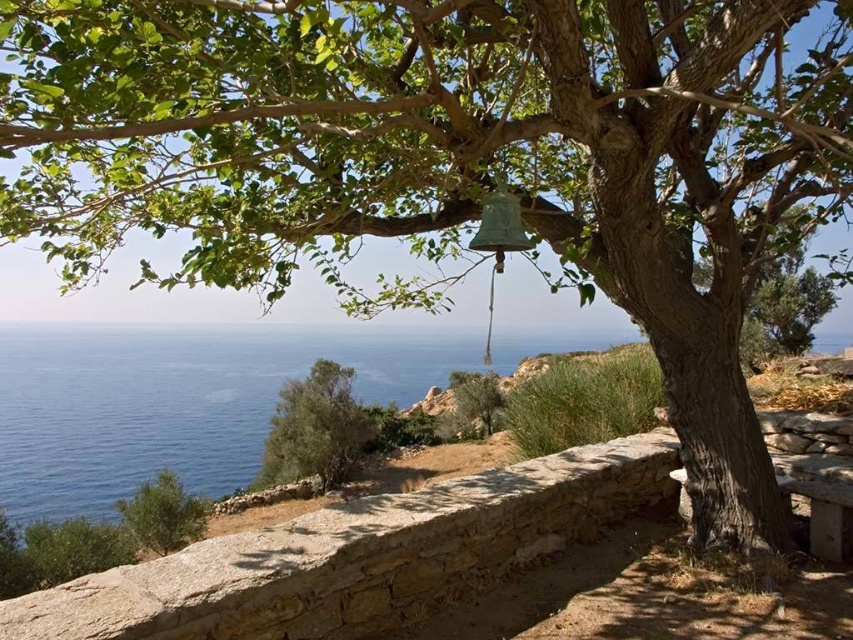
You are standing at the stone wall and want to place a small potted plant between the blue water at lower left and the green leafy shrub at lower left. Based on their positions, where should you place the potted plant relative to the shrub?

The blue water at lower left is above the green leafy shrub at lower left, so you should place the potted plant below the shrub to maintain the vertical order between the blue water at lower left and the green leafy shrub at lower left.

Based on the photo, you are standing in the coastal scene and want to take a photo of the green leafy tree at center without the green leafy shrub at lower left blocking the view. Where should you position yourself relative to the shrub?

You should position yourself behind the green leafy shrub at lower left so that the shrub is between you and the tree, allowing you to capture the green leafy tree at center without obstruction.

You are standing in front of the coastal scene and want to walk towards the blue water at lower left and the green leafy tree at center. Which object will you reach first?

The blue water at lower left is closer to the viewer than the green leafy tree at center, so you will reach the blue water at lower left first.